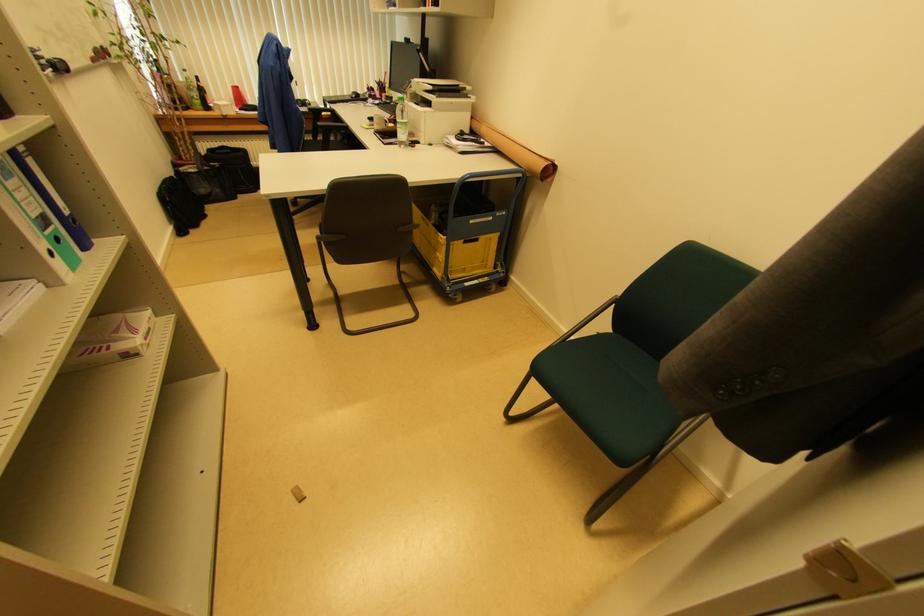
At what (x,y) coordinates should I click in order to perform the action: click on metal chair armrest. Please return your answer as a coordinate pair (x, y). This screenshot has width=924, height=616. Looking at the image, I should click on coord(590,318).